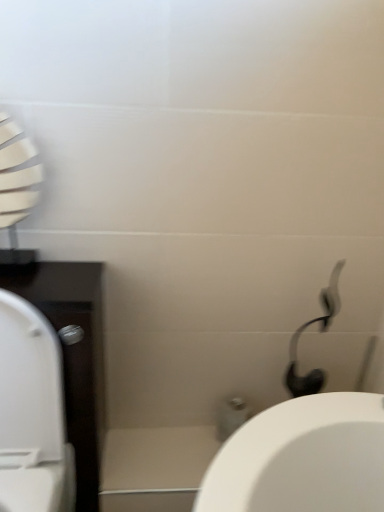
I want to click on free space above white glossy porcelain at center (from a real-world perspective), so click(x=160, y=454).